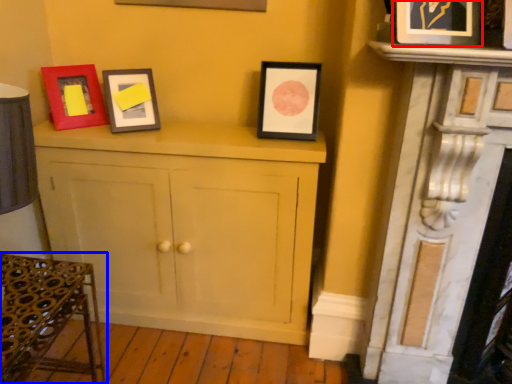
Question: Which object appears farthest to the camera in this image, picture frame (highlighted by a red box) or furniture (highlighted by a blue box)?

Choices:
 (A) picture frame
 (B) furniture

Answer: (A)